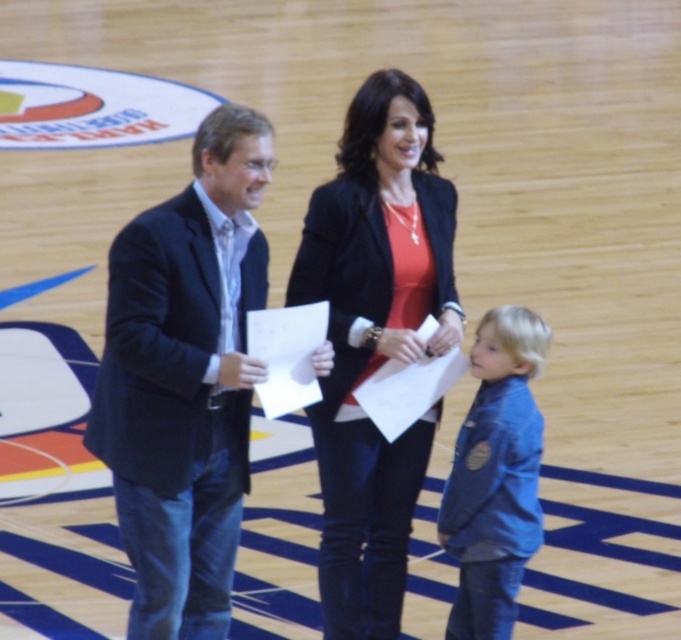
Question: Which object is farther from the camera taking this photo?

Choices:
 (A) denim jacket at lower right
 (B) matte black blazer at center
 (C) dark blue textured suit at left

Answer: (B)

Question: Which object is farther from the camera taking this photo?

Choices:
 (A) matte black blazer at center
 (B) dark blue textured suit at left
 (C) matte black suit at left
 (D) denim jacket at lower right

Answer: (A)

Question: In this image, where is matte black blazer at center located relative to denim jacket at lower right?

Choices:
 (A) below
 (B) above

Answer: (B)

Question: Is matte black blazer at center bigger than dark blue textured suit at left?

Choices:
 (A) no
 (B) yes

Answer: (B)

Question: Which of the following is the farthest from the observer?

Choices:
 (A) (458, 600)
 (B) (240, 401)
 (C) (419, 237)
 (D) (355, 492)

Answer: (A)

Question: Can you confirm if matte black suit at left is positioned below dark blue textured suit at left?

Choices:
 (A) yes
 (B) no

Answer: (B)